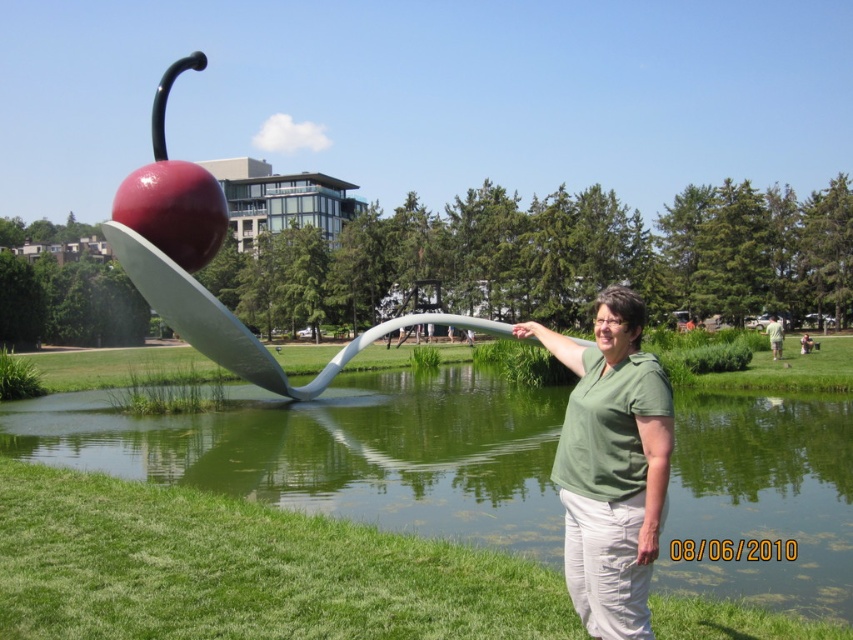
You are standing in the park and see the green matte shirt at center and the glossy red apple at center. Which object is shorter?

The green matte shirt at center is shorter than the glossy red apple at center.